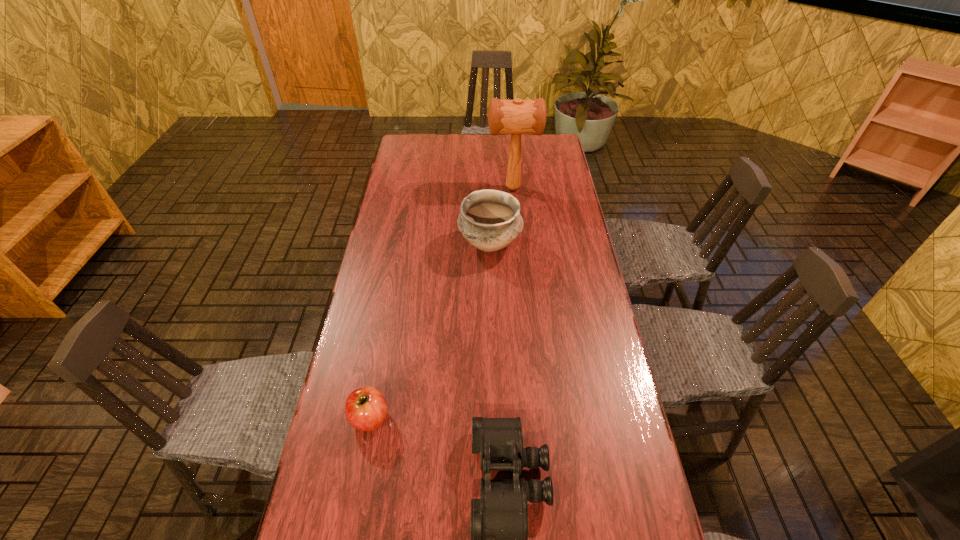
The height and width of the screenshot is (540, 960). In order to click on vacant area that satisfies the following two spatial constraints: 1. on the strike surface of the farthest object; 2. on the front side of the leftmost object in this screenshot , I will do `click(533, 417)`.

Identify the location of blank area in the image that satisfies the following two spatial constraints: 1. on the strike surface of the farthest object; 2. on the front side of the leftmost object. (533, 417).